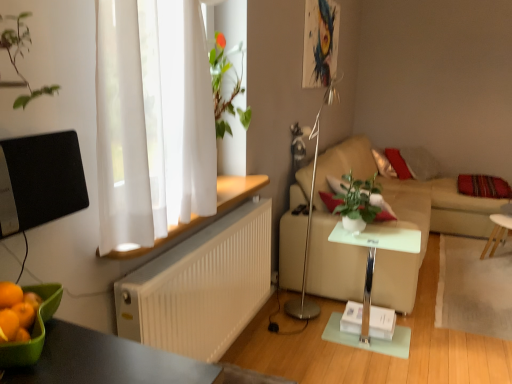
The width and height of the screenshot is (512, 384). I want to click on free spot below green glossy houseplant at center (from a real-world perspective), so click(x=358, y=230).